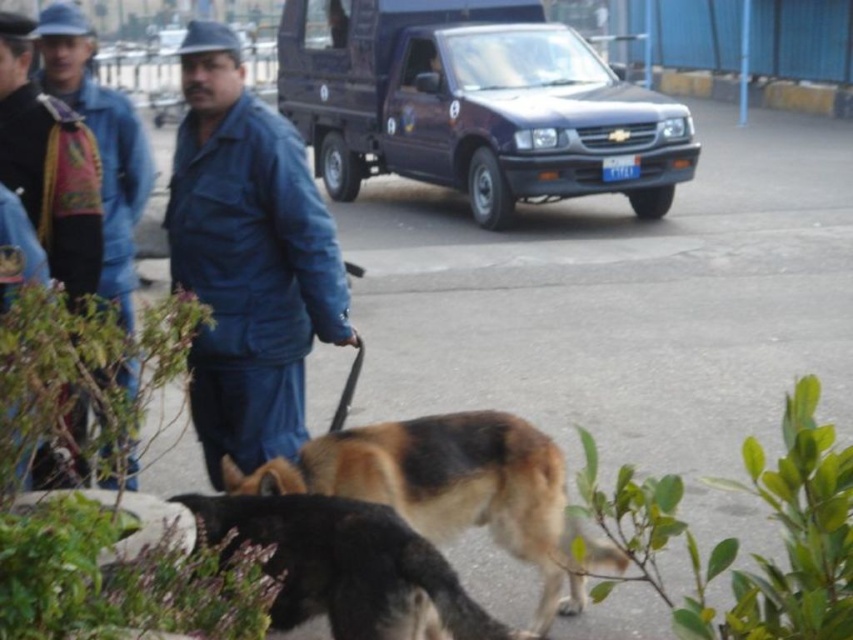
Which is in front, point (384, 163) or point (283, 522)?

Point (283, 522) is more forward.

Can you confirm if metallic blue truck at upper center is positioned below brown fur dog at lower center?

Incorrect, metallic blue truck at upper center is not positioned below brown fur dog at lower center.

Is point (508, 132) positioned after point (418, 589)?

Yes, it is behind point (418, 589).

Locate an element on the screen. metallic blue truck at upper center is located at coordinates (474, 104).

Based on the photo, how distant is brown fur dog at center from brown fur dog at lower center?

21.38 inches

Which is behind, point (389, 486) or point (302, 598)?

Positioned behind is point (389, 486).

Which is in front, point (526, 513) or point (305, 528)?

Point (305, 528) is more forward.

The image size is (853, 640). I want to click on brown fur dog at center, so click(451, 486).

What do you see at coordinates (247, 259) in the screenshot?
I see `blue denim jacket at center` at bounding box center [247, 259].

Who is positioned more to the right, blue denim jacket at center or brown fur dog at center?

brown fur dog at center is more to the right.

Who is more forward, (215,188) or (471,476)?

Point (471,476) is in front.

The width and height of the screenshot is (853, 640). In order to click on blue denim jacket at center in this screenshot , I will do `click(247, 259)`.